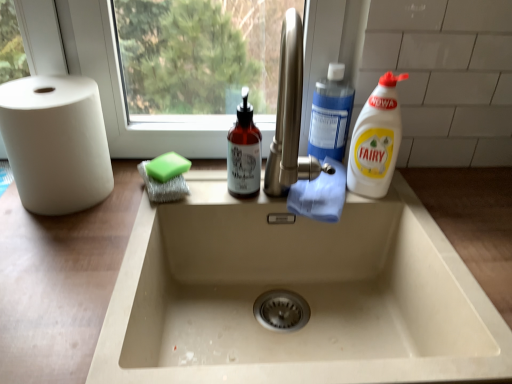
Question: From a real-world perspective, is white plastic bottle at right, positioned as the 1th cleaning product in right-to-left order, physically above blue plastic bottle at upper right, acting as the second cleaning product starting from the right?

Choices:
 (A) no
 (B) yes

Answer: (A)

Question: Is white plastic bottle at right, marked as the third cleaning product in a left-to-right arrangement, positioned before blue plastic bottle at upper right, acting as the second cleaning product starting from the right?

Choices:
 (A) yes
 (B) no

Answer: (A)

Question: From a real-world perspective, is white plastic bottle at right, positioned as the 1th cleaning product in right-to-left order, physically below blue plastic bottle at upper right, acting as the second cleaning product starting from the right?

Choices:
 (A) yes
 (B) no

Answer: (A)

Question: Is blue plastic bottle at upper right, which is counted as the second cleaning product, starting from the left, completely or partially inside white plastic bottle at right, marked as the third cleaning product in a left-to-right arrangement?

Choices:
 (A) no
 (B) yes

Answer: (A)

Question: Does white plastic bottle at right, positioned as the 1th cleaning product in right-to-left order, have a smaller size compared to blue plastic bottle at upper right, which is counted as the second cleaning product, starting from the left?

Choices:
 (A) no
 (B) yes

Answer: (A)

Question: Is white plastic bottle at right, marked as the third cleaning product in a left-to-right arrangement, oriented away from blue plastic bottle at upper right, which is counted as the second cleaning product, starting from the left?

Choices:
 (A) yes
 (B) no

Answer: (B)

Question: Does translucent amber bottle at center, which is the 3th cleaning product in right-to-left order, have a lesser width compared to blue plastic bottle at upper right, which is counted as the second cleaning product, starting from the left?

Choices:
 (A) yes
 (B) no

Answer: (B)

Question: Does translucent amber bottle at center, which is the 3th cleaning product in right-to-left order, lie in front of blue plastic bottle at upper right, which is counted as the second cleaning product, starting from the left?

Choices:
 (A) yes
 (B) no

Answer: (A)

Question: Is blue plastic bottle at upper right, which is counted as the second cleaning product, starting from the left, located within translucent amber bottle at center, which is the 3th cleaning product in right-to-left order?

Choices:
 (A) no
 (B) yes

Answer: (A)

Question: Considering the relative sizes of translucent amber bottle at center, which is the 3th cleaning product in right-to-left order, and blue plastic bottle at upper right, acting as the second cleaning product starting from the right, in the image provided, is translucent amber bottle at center, which is the 3th cleaning product in right-to-left order, taller than blue plastic bottle at upper right, acting as the second cleaning product starting from the right,?

Choices:
 (A) no
 (B) yes

Answer: (B)

Question: From the image's perspective, is translucent amber bottle at center, the first cleaning product in the left-to-right sequence, above blue plastic bottle at upper right, which is counted as the second cleaning product, starting from the left?

Choices:
 (A) no
 (B) yes

Answer: (A)

Question: From the image's perspective, is translucent amber bottle at center, which is the 3th cleaning product in right-to-left order, located beneath blue plastic bottle at upper right, which is counted as the second cleaning product, starting from the left?

Choices:
 (A) no
 (B) yes

Answer: (B)

Question: From a real-world perspective, is white plastic bottle at right, positioned as the 1th cleaning product in right-to-left order, beneath translucent amber bottle at center, which is the 3th cleaning product in right-to-left order?

Choices:
 (A) yes
 (B) no

Answer: (B)